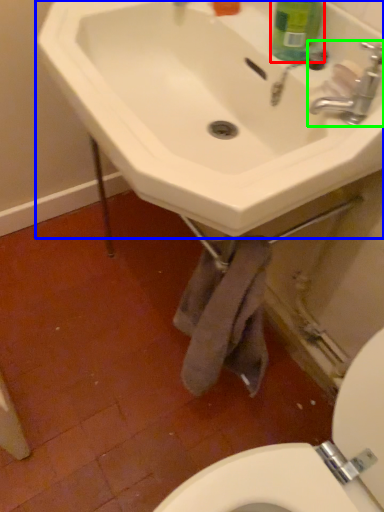
Question: Which object is the closest to the cleaning product (highlighted by a red box)? Choose among these: sink (highlighted by a blue box) or tap (highlighted by a green box).

Choices:
 (A) sink
 (B) tap

Answer: (B)